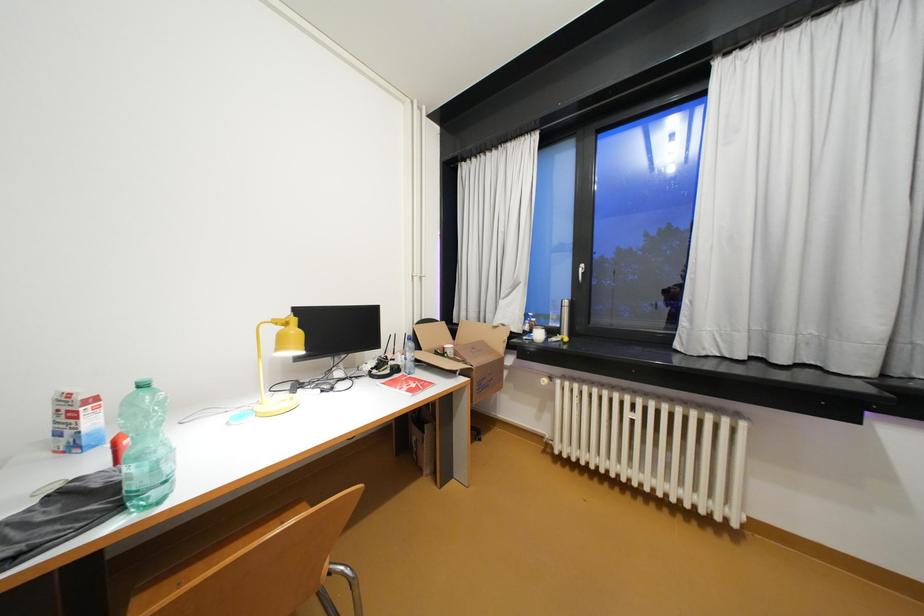
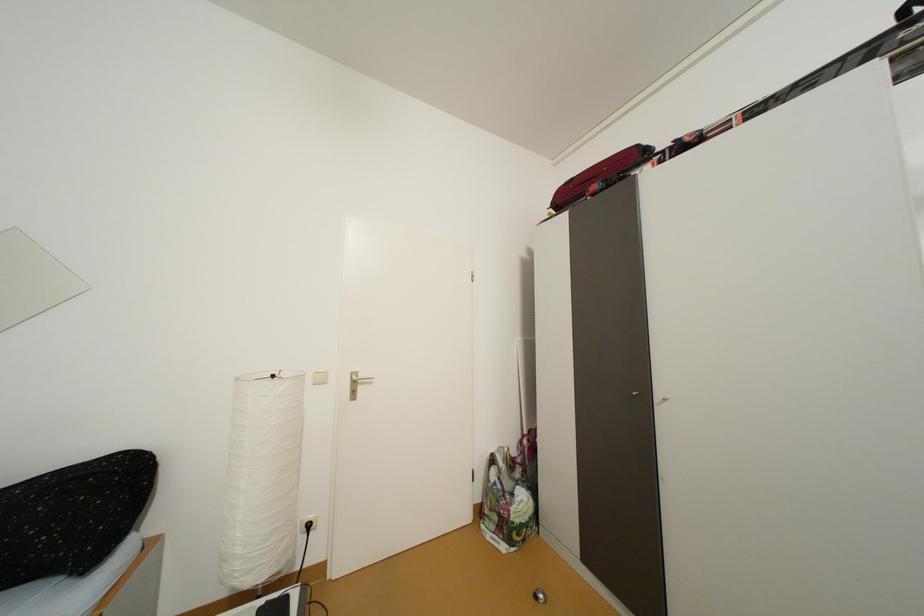
Question: The first image is from the beginning of the video and the second image is from the end. How did the camera likely rotate when shooting the video?

Choices:
 (A) Left
 (B) Right
 (C) Up
 (D) Down

Answer: (A)